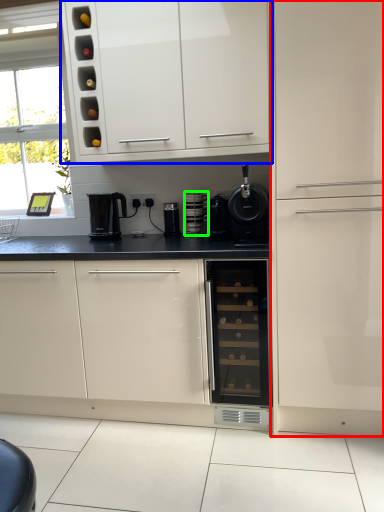
Question: Which object is the farthest from cabinetry (highlighted by a red box)? Choose among these: cabinetry (highlighted by a blue box) or kitchen appliance (highlighted by a green box).

Choices:
 (A) cabinetry
 (B) kitchen appliance

Answer: (B)